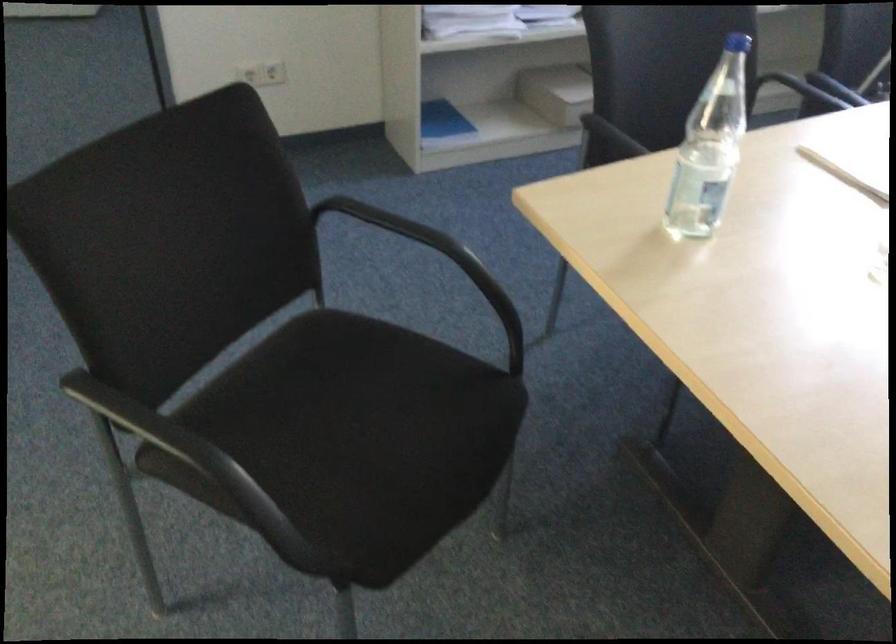
The height and width of the screenshot is (644, 896). I want to click on chair sitting surface, so click(x=352, y=430).